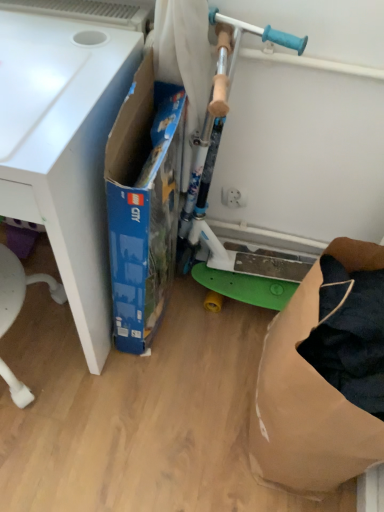
This screenshot has height=512, width=384. In order to click on vacant space in front of green plastic scooter at center in this screenshot , I will do `click(205, 377)`.